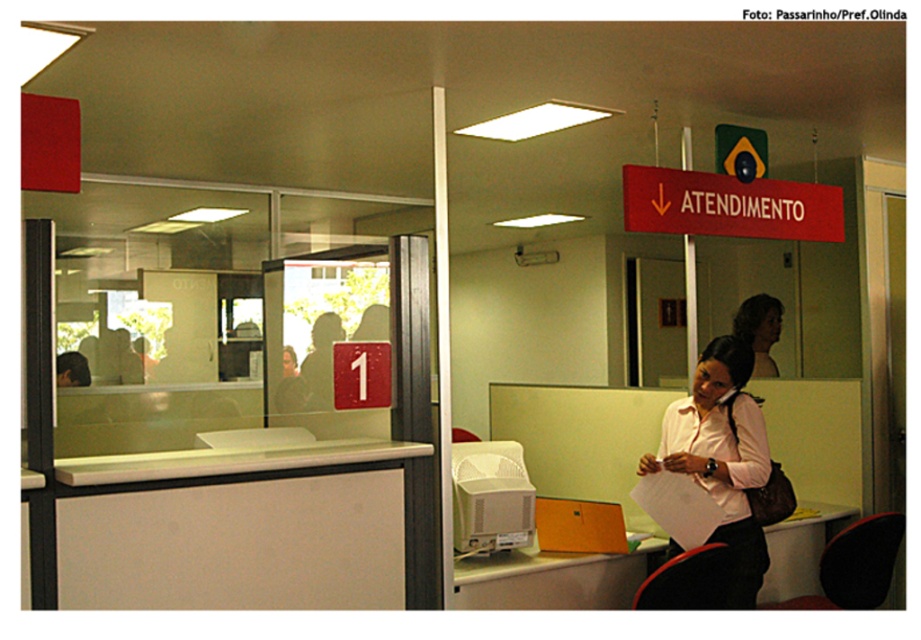
You are standing at the desk in the public service office. There are two points marked in the scene. The first point is at coordinates point (610, 598) and the second point is at point (764, 305). Which point is closer to you?

Point (610, 598) is in front of point (764, 305), so it is closer to you.

You are a customer in this office and you need to locate the point at coordinates [724,458]. Where would you find this point?

The point at coordinates [724,458] is located on the white matte shirt at center.